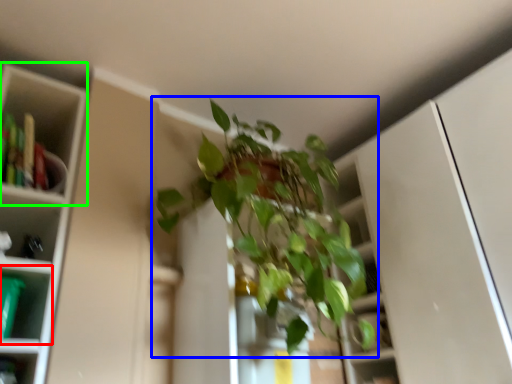
Question: Considering the real-world distances, which object is closest to shelf (highlighted by a red box)? houseplant (highlighted by a blue box) or cabinet (highlighted by a green box).

Choices:
 (A) houseplant
 (B) cabinet

Answer: (B)